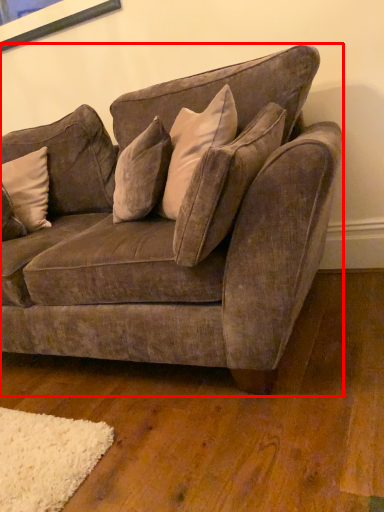
Question: Observing the image, what is the correct spatial positioning of studio couch (annotated by the red box) in reference to pillow?

Choices:
 (A) right
 (B) left

Answer: (A)